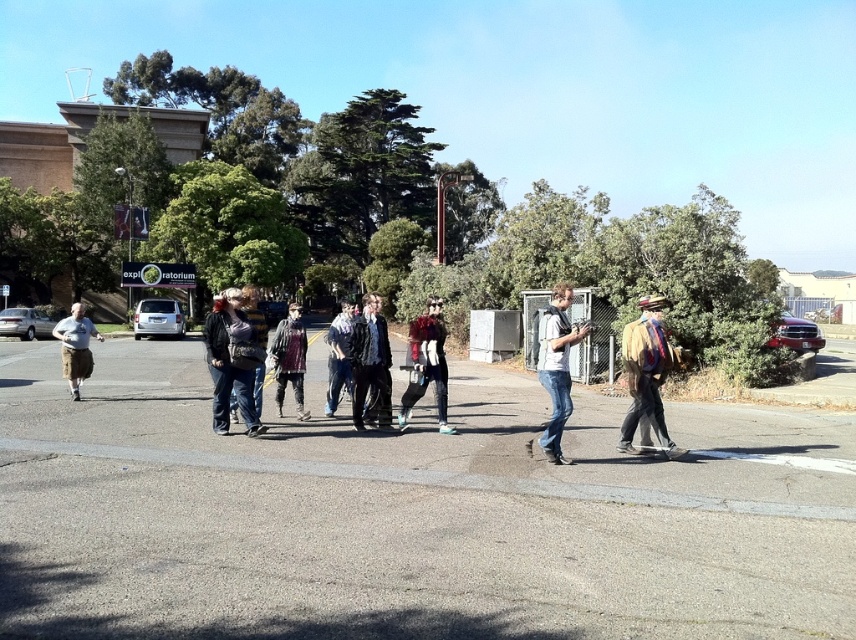
You are a photographer trying to capture a clear shot of the denim jeans at center without the distressed denim jacket at center blocking it. Based on the scene, can you position yourself in a way to achieve this?

The denim jeans at center is in front of the distressed denim jacket at center, so positioning yourself behind the denim jeans at center would allow you to capture it without the jacket blocking the view.

You are a fashion designer observing a group of people walking on a road. You notice the denim jeans at center and the distressed denim jacket at center. Which clothing item is positioned higher on the person?

The denim jeans at center is above the distressed denim jacket at center, so the denim jeans at center is positioned higher on the person.

You are a photographer trying to capture both the brown leather jacket at center and the distressed denim jacket at center in a single frame. Based on their positions, which jacket would appear closer to the camera in the photo?

The brown leather jacket at center appears closer to the camera because it is positioned below the distressed denim jacket at center, indicating it is in a lower plane relative to the viewer.